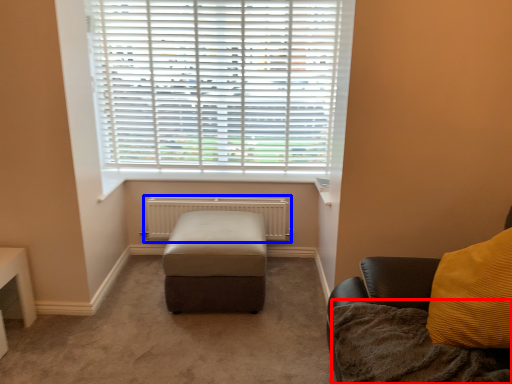
Question: Which object is further to the camera taking this photo, blanket (highlighted by a red box) or radiator (highlighted by a blue box)?

Choices:
 (A) blanket
 (B) radiator

Answer: (B)